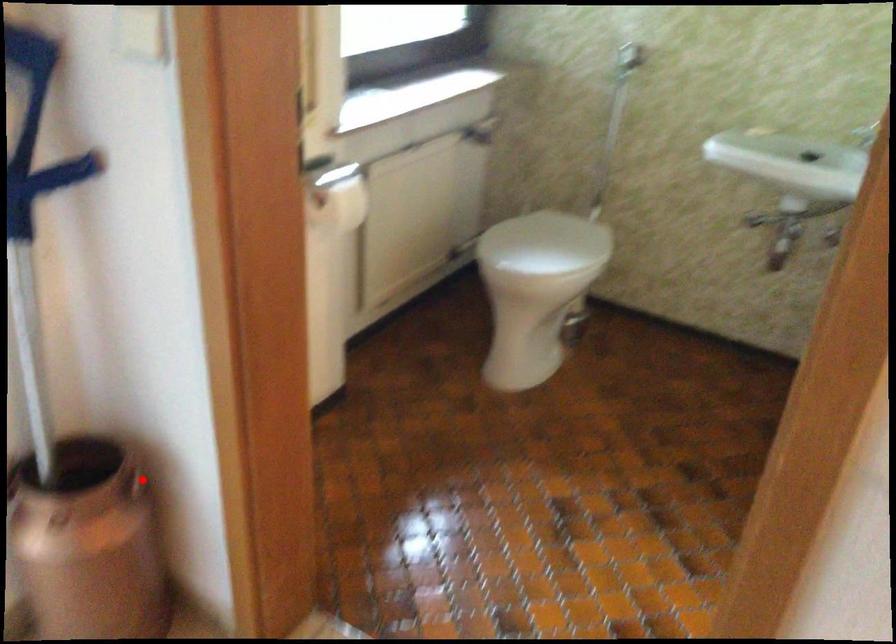
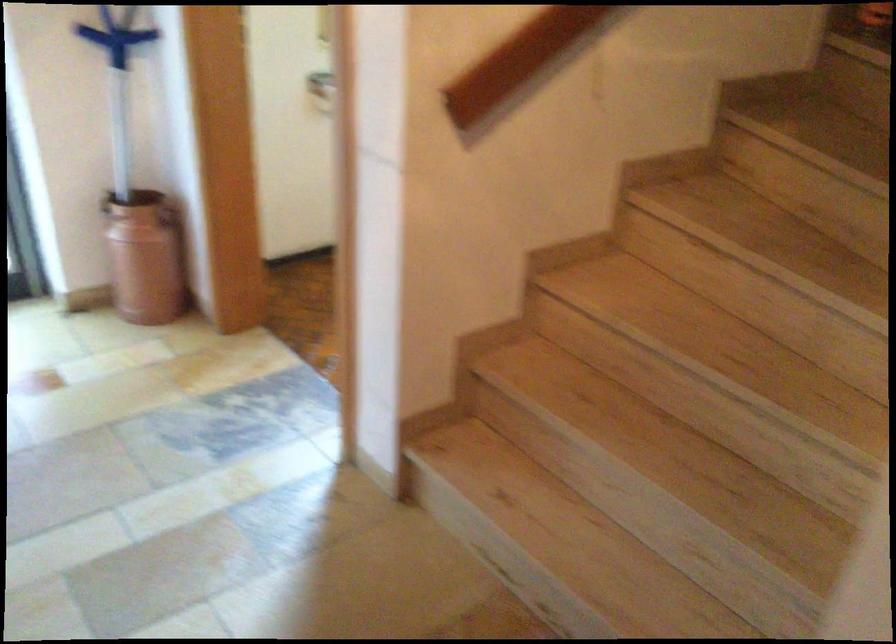
Find the pixel in the second image that matches the highlighted location in the first image.

(168, 216)